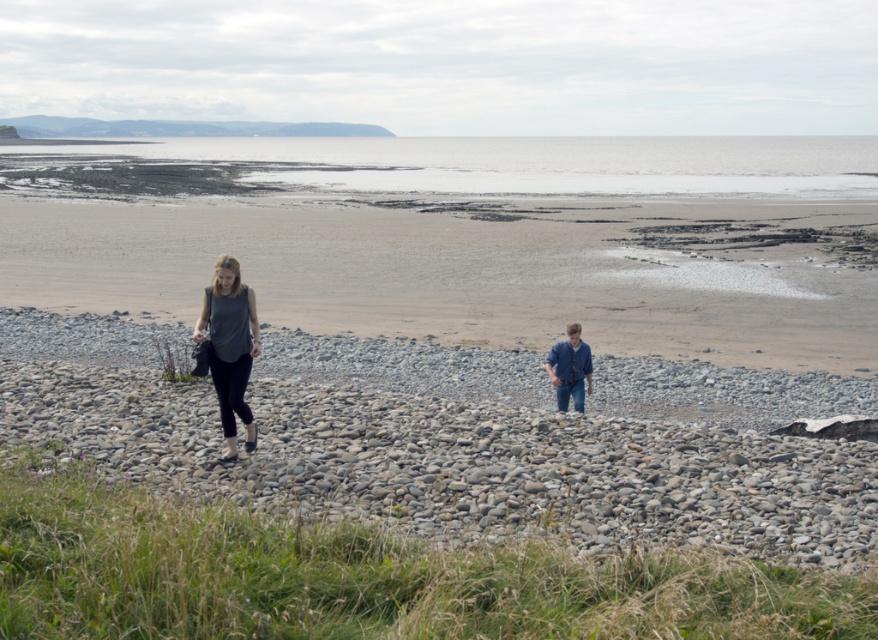
You are a photographer trying to capture the gray smooth pebbles at center and the blue denim jeans at lower right in the same frame. Which object will appear larger in the photo?

The gray smooth pebbles at center will appear larger in the photo because they have a greater height compared to the blue denim jeans at lower right.